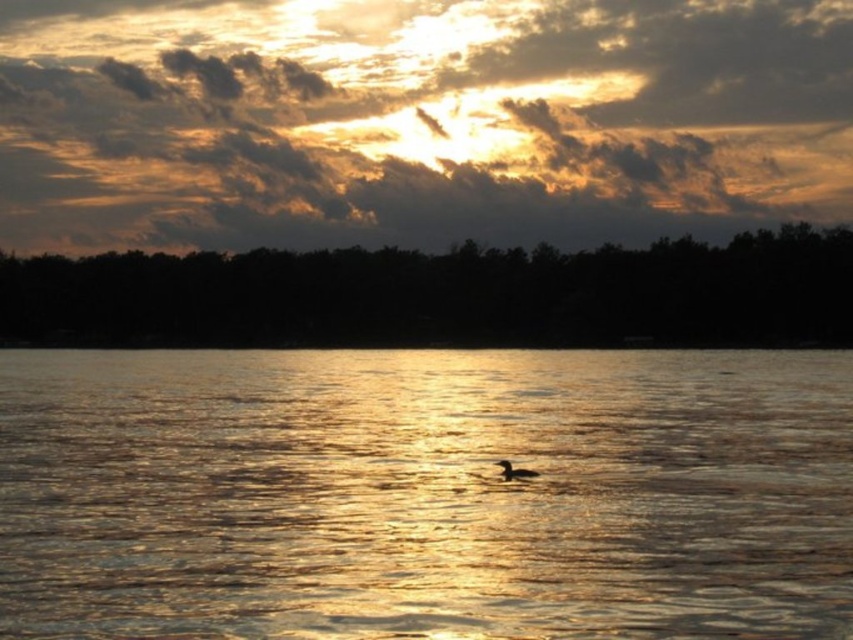
Question: Estimate the real-world distances between objects in this image. Which object is closer to the brown matte duck at center?

Choices:
 (A) golden textured clouds at upper center
 (B) glistening water at center

Answer: (B)

Question: Which of the following is the closest to the observer?

Choices:
 (A) glistening water at center
 (B) brown matte duck at center

Answer: (A)

Question: In this image, where is glistening water at center located relative to golden textured clouds at upper center?

Choices:
 (A) above
 (B) below

Answer: (B)

Question: Which object appears closest to the camera in this image?

Choices:
 (A) brown matte duck at center
 (B) glistening water at center

Answer: (B)

Question: Observing the image, what is the correct spatial positioning of glistening water at center in reference to brown matte duck at center?

Choices:
 (A) left
 (B) right

Answer: (A)

Question: Can you confirm if glistening water at center is positioned above golden textured clouds at upper center?

Choices:
 (A) no
 (B) yes

Answer: (A)